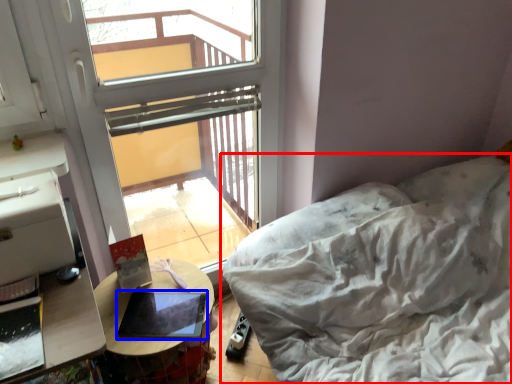
Question: Which of the following is the closest to the observer, furniture (highlighted by a red box) or laptop (highlighted by a blue box)?

Choices:
 (A) furniture
 (B) laptop

Answer: (A)